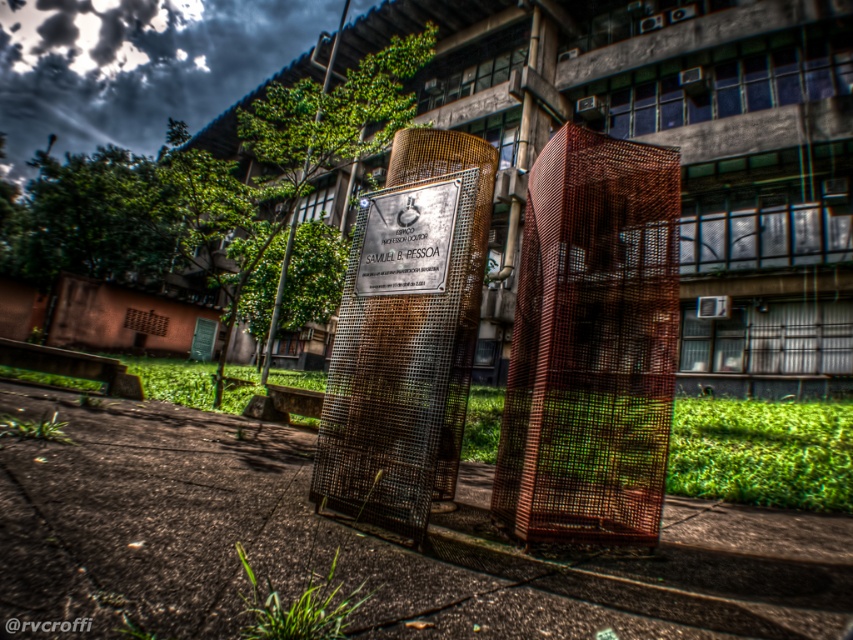
Based on the photo, is rusty wire mesh at center smaller than rusty mesh cage at center?

Correct, rusty wire mesh at center occupies less space than rusty mesh cage at center.

Where is `rusty wire mesh at center`? The height and width of the screenshot is (640, 853). rusty wire mesh at center is located at coordinates (590, 344).

Locate an element on the screen. The image size is (853, 640). rusty wire mesh at center is located at coordinates (590, 344).

Between rusty mesh cage at center and polished brass plaque at center, which one is positioned higher?

polished brass plaque at center

The width and height of the screenshot is (853, 640). Find the location of `rusty mesh cage at center`. rusty mesh cage at center is located at coordinates (405, 355).

Does rusty wire mesh at center come in front of polished brass plaque at center?

Yes, it is in front of polished brass plaque at center.

Locate an element on the screen. The image size is (853, 640). rusty wire mesh at center is located at coordinates tap(590, 344).

Between point (646, 387) and point (457, 195), which one is positioned in front?

Point (457, 195)

In order to click on rusty wire mesh at center in this screenshot , I will do `click(590, 344)`.